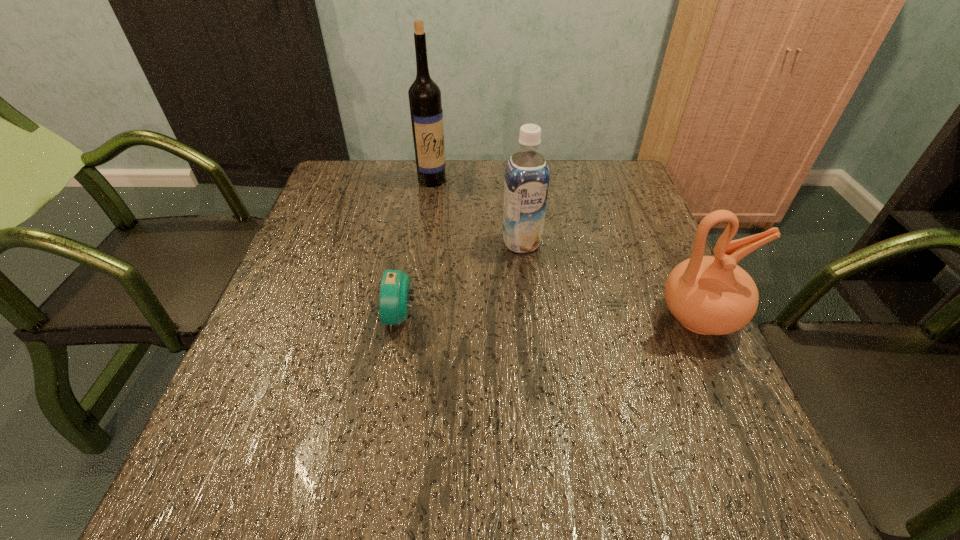
Image resolution: width=960 pixels, height=540 pixels. I want to click on free space at the far left corner, so click(x=353, y=191).

Image resolution: width=960 pixels, height=540 pixels. In the image, there is a desktop. Find the location of `vacant space at the near left corner`. vacant space at the near left corner is located at coordinates (260, 418).

Find the location of a particular element. The height and width of the screenshot is (540, 960). free region at the far right corner is located at coordinates (621, 177).

At what (x,y) coordinates should I click in order to perform the action: click on vacant space at the near right corner of the desktop. Please return your answer as a coordinate pair (x, y). Looking at the image, I should click on (660, 404).

Image resolution: width=960 pixels, height=540 pixels. Find the location of `free space between the alarm clock and the pottery`. free space between the alarm clock and the pottery is located at coordinates (550, 318).

Find the location of a particular element. This screenshot has width=960, height=540. free spot between the second farthest object and the rightmost object is located at coordinates (610, 280).

Find the location of a particular element. empty space between the alarm clock and the wine bottle is located at coordinates (417, 248).

Image resolution: width=960 pixels, height=540 pixels. I want to click on free space between the shortest object and the rightmost object, so (550, 318).

Locate an element on the screen. Image resolution: width=960 pixels, height=540 pixels. empty space that is in between the wine bottle and the third nearest object is located at coordinates (477, 211).

Where is `vacant point located between the alarm clock and the third object from left to right`? The width and height of the screenshot is (960, 540). vacant point located between the alarm clock and the third object from left to right is located at coordinates (462, 280).